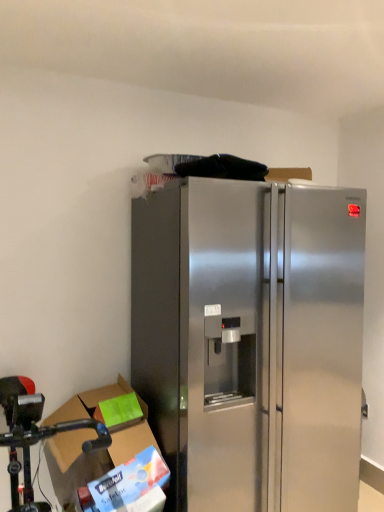
In order to face cardboard box at lower left, should I rotate leftwards or rightwards?

Turn left by 12.847 degrees to look at cardboard box at lower left.

What do you see at coordinates (35, 435) in the screenshot?
I see `stainless steel fridge at lower left` at bounding box center [35, 435].

Find the location of `stainless steel refrigerator at center`. stainless steel refrigerator at center is located at coordinates (251, 341).

Looking at this image, considering the sizes of objects stainless steel fridge at lower left and cardboard box at lower left in the image provided, who is wider, stainless steel fridge at lower left or cardboard box at lower left?

stainless steel fridge at lower left is wider.

Is point (32, 499) more distant than point (114, 435)?

No, it is in front of (114, 435).

From a real-world perspective, relative to cardboard box at lower left, is stainless steel fridge at lower left vertically above or below?

stainless steel fridge at lower left is situated lower than cardboard box at lower left in the real world.

Does stainless steel refrigerator at center have a larger size compared to cardboard box at lower left?

Yes.

From a real-world perspective, relative to cardboard box at lower left, is stainless steel refrigerator at center vertically above or below?

Clearly, from a real-world perspective, stainless steel refrigerator at center is above cardboard box at lower left.

Is stainless steel refrigerator at center not inside cardboard box at lower left?

Yes.

I want to click on refrigerator that is on the right side of cardboard box at lower left, so click(x=251, y=341).

Which of these two, cardboard box at lower left or stainless steel refrigerator at center, is smaller?

cardboard box at lower left.

Which object is thinner, cardboard box at lower left or stainless steel refrigerator at center?

cardboard box at lower left is thinner.

How much distance is there between cardboard box at lower left and stainless steel refrigerator at center?

cardboard box at lower left is 55.51 centimeters away from stainless steel refrigerator at center.

Is cardboard box at lower left facing away from stainless steel fridge at lower left?

That's not correct — cardboard box at lower left is not looking away from stainless steel fridge at lower left.

What's the angular difference between cardboard box at lower left and stainless steel fridge at lower left's facing directions?

The angular difference between cardboard box at lower left and stainless steel fridge at lower left is 0.00057 degrees.

Is cardboard box at lower left closer to camera compared to stainless steel fridge at lower left?

No, cardboard box at lower left is behind stainless steel fridge at lower left.

Between cardboard box at lower left and stainless steel fridge at lower left, which one has more height?

Standing taller between the two is stainless steel fridge at lower left.

Is stainless steel refrigerator at center positioned with its back to stainless steel fridge at lower left?

No, stainless steel refrigerator at center's orientation is not away from stainless steel fridge at lower left.

Is stainless steel refrigerator at center positioned behind stainless steel fridge at lower left?

Yes, stainless steel refrigerator at center is further from the viewer.

From the picture: Between stainless steel refrigerator at center and stainless steel fridge at lower left, which one has larger width?

Wider between the two is stainless steel fridge at lower left.

Could you tell me if stainless steel fridge at lower left is turned towards stainless steel refrigerator at center?

No, stainless steel fridge at lower left is not facing towards stainless steel refrigerator at center.

Considering the relative sizes of stainless steel fridge at lower left and stainless steel refrigerator at center in the image provided, is stainless steel fridge at lower left wider than stainless steel refrigerator at center?

Indeed, stainless steel fridge at lower left has a greater width compared to stainless steel refrigerator at center.

Is point (22, 448) in front of point (301, 483)?

Yes, point (22, 448) is in front of point (301, 483).

From the image's perspective, does stainless steel fridge at lower left appear lower than stainless steel refrigerator at center?

Yes.

This screenshot has width=384, height=512. There is a stainless steel fridge at lower left. Identify the location of cardboard box above it (from a real-world perspective). tap(93, 455).

At what (x,y) coordinates should I click in order to perform the action: click on cardboard box below the stainless steel refrigerator at center (from the image's perspective). Please return your answer as a coordinate pair (x, y). This screenshot has width=384, height=512. Looking at the image, I should click on (93, 455).

From the image, which object appears to be nearer to stainless steel refrigerator at center, cardboard box at lower left or stainless steel fridge at lower left?

cardboard box at lower left is positioned closer to the anchor stainless steel refrigerator at center.

Estimate the real-world distances between objects in this image. Which object is closer to stainless steel fridge at lower left, cardboard box at lower left or stainless steel refrigerator at center?

Among the two, cardboard box at lower left is located nearer to stainless steel fridge at lower left.

From the picture: From the image, which object appears to be farther from cardboard box at lower left, stainless steel fridge at lower left or stainless steel refrigerator at center?

stainless steel refrigerator at center.

From the picture: Looking at the image, which one is located further to cardboard box at lower left, stainless steel refrigerator at center or stainless steel fridge at lower left?

stainless steel refrigerator at center.

From the image, which object appears to be nearer to stainless steel refrigerator at center, stainless steel fridge at lower left or cardboard box at lower left?

cardboard box at lower left.

Looking at the image, which one is located closer to stainless steel fridge at lower left, stainless steel refrigerator at center or cardboard box at lower left?

Among the two, cardboard box at lower left is located nearer to stainless steel fridge at lower left.

Where is `cardboard box between stainless steel fridge at lower left and stainless steel refrigerator at center in the horizontal direction`? cardboard box between stainless steel fridge at lower left and stainless steel refrigerator at center in the horizontal direction is located at coordinates (93, 455).